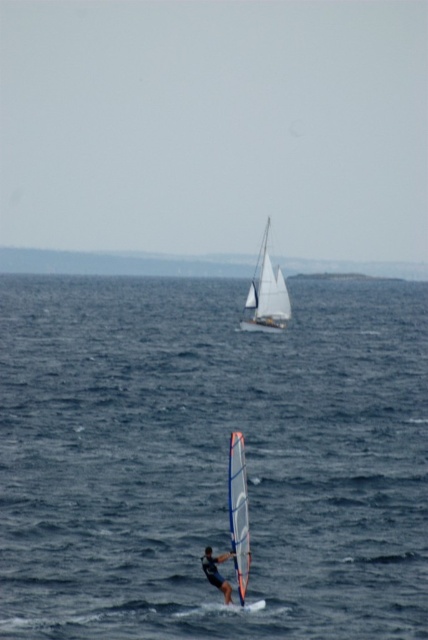
You are a marine biologist studying ocean currents and need to place a buoy at the exact center of the blue water at center. According to the coordinates provided, where should you place the buoy?

The buoy should be placed at the coordinates point (211, 458) as that is the exact center of the blue water at center.

You are a photographer standing on a cliff overlooking the sea. You want to capture a photo of the point at coordinates point (333, 310). If your camera has a maximum focus range of 400 feet, will you be able to focus on that point?

The point (333, 310) is 435.13 feet away from the camera, which exceeds the camera maximum focus range of 400 feet. Therefore, the camera cannot focus on that point.